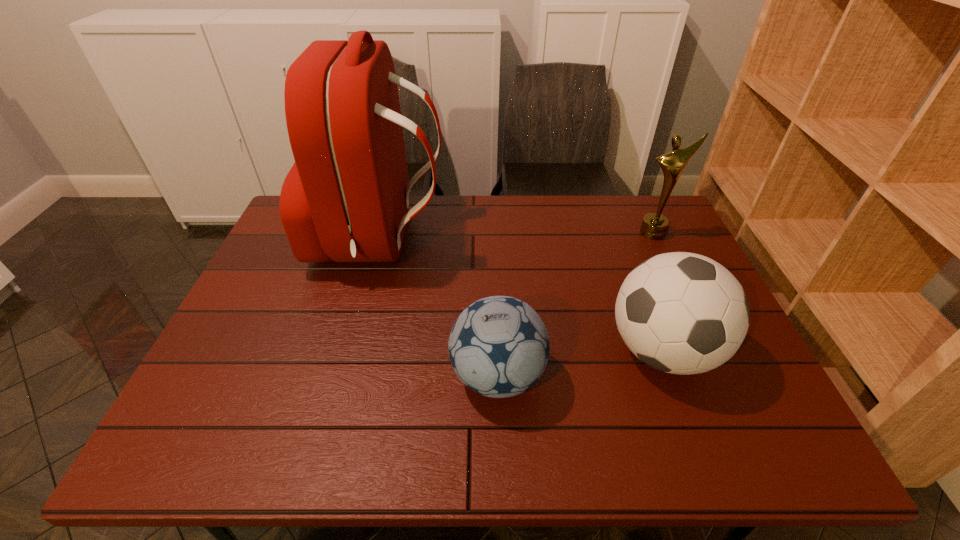
Locate an element on the screen. vacant space at the far edge is located at coordinates point(497,201).

Identify the location of vacant space at the near edge. (689, 448).

In the image, there is a desktop. What are the coordinates of `free region at the left edge` in the screenshot? It's located at (270, 259).

Where is `vacant space at the right edge of the desktop`? vacant space at the right edge of the desktop is located at coordinates (721, 372).

Find the location of a particular element. This screenshot has width=960, height=540. free region at the near right corner of the desktop is located at coordinates (753, 434).

The width and height of the screenshot is (960, 540). Identify the location of vacant area between the third shortest object and the tallest object. (517, 237).

I want to click on free space between the award and the leftmost object, so click(x=517, y=237).

Where is `free space between the backpack and the right soccer ball`? This screenshot has width=960, height=540. free space between the backpack and the right soccer ball is located at coordinates (521, 295).

You are a GUI agent. You are given a task and a screenshot of the screen. Output one action in this format:
    pyautogui.click(x=<x>, y=<y>)
    Task: Click on the free space that is in between the award and the backpack
    Image resolution: width=960 pixels, height=540 pixels.
    Given the screenshot: What is the action you would take?
    pyautogui.click(x=517, y=237)

Where is `vacant area between the award and the left soccer ball`? The height and width of the screenshot is (540, 960). vacant area between the award and the left soccer ball is located at coordinates (575, 304).